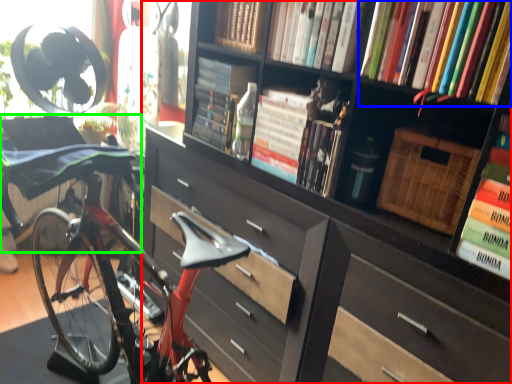
Question: Considering the real-world distances, which object is farthest from bookcase (highlighted by a red box)? book (highlighted by a blue box) or swivel chair (highlighted by a green box)?

Choices:
 (A) book
 (B) swivel chair

Answer: (B)